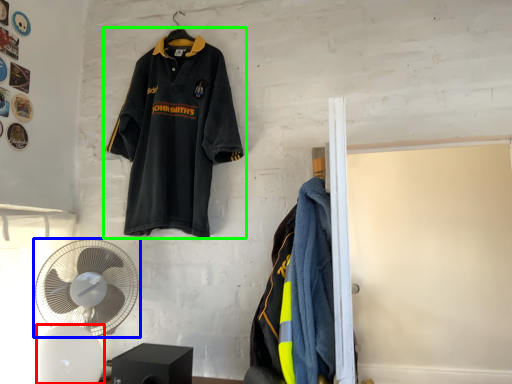
Question: Which object is the closest to the mechanical fan (highlighted by a red box)? Choose among these: mechanical fan (highlighted by a blue box) or sports uniform (highlighted by a green box).

Choices:
 (A) mechanical fan
 (B) sports uniform

Answer: (A)